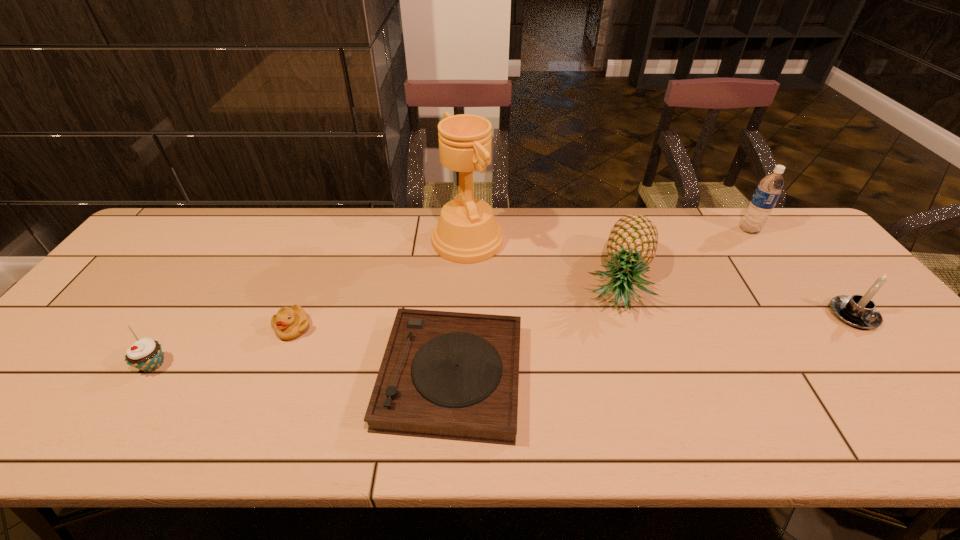
Locate an element on the screen. Image resolution: width=960 pixels, height=540 pixels. free spot between the shortest object and the rightmost object is located at coordinates (652, 346).

Locate an element on the screen. unoccupied position between the duckling and the sixth object from left to right is located at coordinates (521, 279).

Find the location of a particular element. Image resolution: width=960 pixels, height=540 pixels. vacant area that lies between the sixth tallest object and the water bottle is located at coordinates (521, 279).

I want to click on empty location between the award and the cupcake, so click(x=310, y=302).

Locate an element on the screen. The height and width of the screenshot is (540, 960). unoccupied position between the sixth shortest object and the award is located at coordinates (609, 235).

At what (x,y) coordinates should I click in order to perform the action: click on blank region between the third object from right to left and the tallest object. Please return your answer as a coordinate pair (x, y). The image size is (960, 540). Looking at the image, I should click on (543, 261).

At what (x,y) coordinates should I click in order to perform the action: click on vacant area that lies between the water bottle and the phonograph record. Please return your answer as a coordinate pair (x, y). Looking at the image, I should click on tap(600, 303).

Image resolution: width=960 pixels, height=540 pixels. What are the coordinates of `free space between the second tallest object and the tallest object` in the screenshot? It's located at (609, 235).

Identify the location of vacant area that lies between the phonograph record and the duckling. (372, 352).

Choose which object is the third nearest neighbor to the award. Please provide its 2D coordinates. Your answer should be formatted as a tuple, i.e. [(x, y)], where the tuple contains the x and y coordinates of a point satisfying the conditions above.

[(289, 323)]